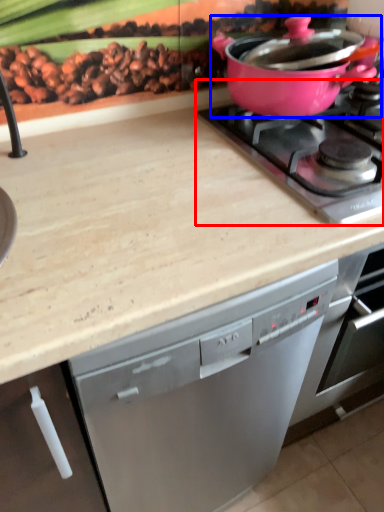
Question: Which of the following is the farthest to the observer, gas stove (highlighted by a red box) or kitchen appliance (highlighted by a blue box)?

Choices:
 (A) gas stove
 (B) kitchen appliance

Answer: (B)